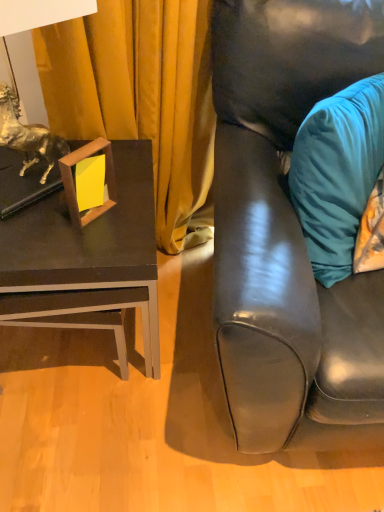
Question: Does matte black couch at right have a greater height compared to matte black table at left?

Choices:
 (A) yes
 (B) no

Answer: (A)

Question: From a real-world perspective, does matte black couch at right stand above matte black table at left?

Choices:
 (A) yes
 (B) no

Answer: (A)

Question: Can you confirm if matte black couch at right is shorter than matte black table at left?

Choices:
 (A) no
 (B) yes

Answer: (A)

Question: Is matte black couch at right thinner than matte black table at left?

Choices:
 (A) yes
 (B) no

Answer: (B)

Question: Is matte black couch at right far from matte black table at left?

Choices:
 (A) no
 (B) yes

Answer: (A)

Question: In terms of size, does matte black couch at right appear bigger or smaller than matte black table at left?

Choices:
 (A) small
 (B) big

Answer: (B)

Question: In terms of height, does matte black couch at right look taller or shorter compared to matte black table at left?

Choices:
 (A) tall
 (B) short

Answer: (A)

Question: Relative to matte black table at left, is matte black couch at right in front or behind?

Choices:
 (A) front
 (B) behind

Answer: (A)

Question: Which is correct: matte black couch at right is inside matte black table at left, or outside of it?

Choices:
 (A) inside
 (B) outside

Answer: (B)

Question: Considering the positions of point (382, 118) and point (107, 159), is point (382, 118) closer or farther from the camera than point (107, 159)?

Choices:
 (A) farther
 (B) closer

Answer: (B)

Question: Is teal velvet pillow at right bigger or smaller than woodenobject at left?

Choices:
 (A) small
 (B) big

Answer: (B)

Question: From the image's perspective, is teal velvet pillow at right positioned above or below woodenobject at left?

Choices:
 (A) above
 (B) below

Answer: (A)

Question: Is teal velvet pillow at right taller or shorter than woodenobject at left?

Choices:
 (A) short
 (B) tall

Answer: (B)

Question: Considering the positions of woodenobject at left and matte black table at left in the image, is woodenobject at left taller or shorter than matte black table at left?

Choices:
 (A) tall
 (B) short

Answer: (B)

Question: Based on their sizes in the image, would you say woodenobject at left is bigger or smaller than matte black table at left?

Choices:
 (A) big
 (B) small

Answer: (B)